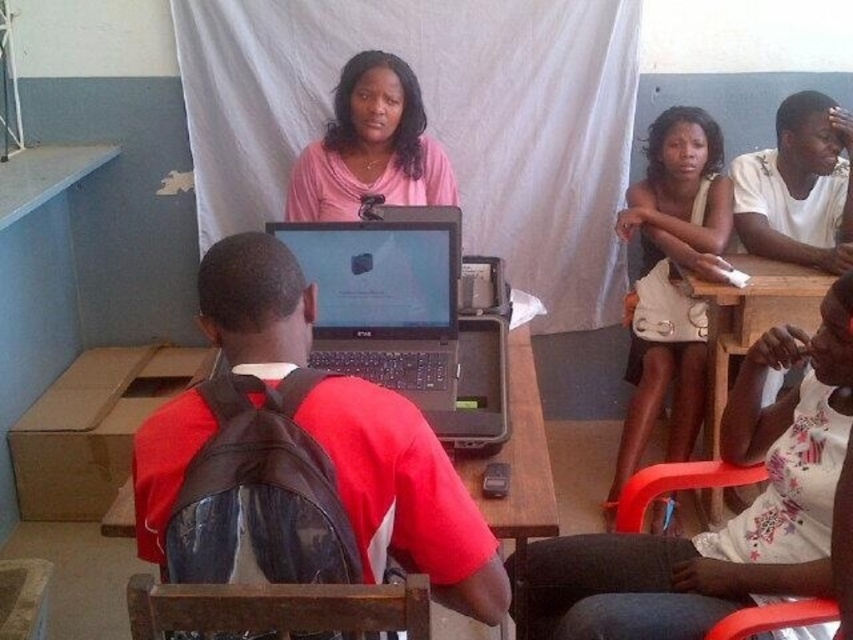
What do you see at coordinates (671, 280) in the screenshot?
I see `matte white skirt at center` at bounding box center [671, 280].

Is point (683, 148) more distant than point (198, 620)?

That is True.

The width and height of the screenshot is (853, 640). Identify the location of matte white skirt at center. (671, 280).

Does matte white skirt at center have a smaller size compared to rubberized plastic chair at lower right?

Actually, matte white skirt at center might be larger than rubberized plastic chair at lower right.

Is point (676, 328) positioned before point (827, 637)?

No, it is behind (827, 637).

Image resolution: width=853 pixels, height=640 pixels. Identify the location of matte white skirt at center. (671, 280).

Is floral fabric shirt at right thinner than matte white skirt at center?

In fact, floral fabric shirt at right might be wider than matte white skirt at center.

From the picture: Can you confirm if floral fabric shirt at right is smaller than matte white skirt at center?

Correct, floral fabric shirt at right occupies less space than matte white skirt at center.

Which is behind, point (834, 353) or point (672, 412)?

The point (672, 412) is behind.

Identify the location of floral fabric shirt at right. The image size is (853, 640). (728, 520).